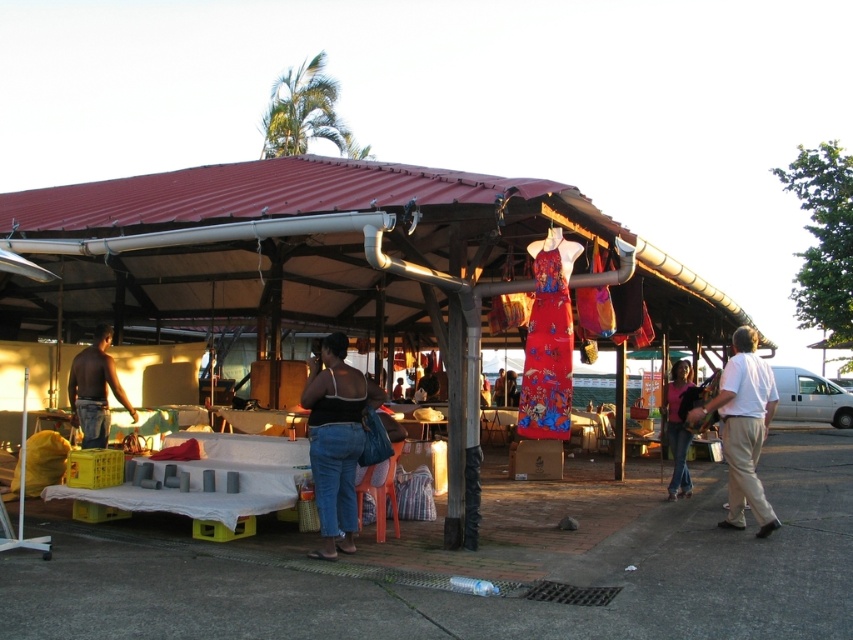
Which of these two, matte plastic dress at center or shiny black skin at left, stands taller?

Standing taller between the two is matte plastic dress at center.

Does point (466, 452) come in front of point (94, 380)?

Yes, it is in front of point (94, 380).

At what (x,y) coordinates should I click in order to perform the action: click on matte plastic dress at center. Please return your answer as a coordinate pair (x, y). This screenshot has width=853, height=640. Looking at the image, I should click on click(x=329, y=259).

In the scene shown: Is white cotton shirt at right shorter than shiny black skin at left?

Incorrect, white cotton shirt at right's height does not fall short of shiny black skin at left's.

Is white cotton shirt at right in front of shiny black skin at left?

Yes, white cotton shirt at right is closer to the viewer.

The width and height of the screenshot is (853, 640). What do you see at coordinates (743, 428) in the screenshot?
I see `white cotton shirt at right` at bounding box center [743, 428].

The height and width of the screenshot is (640, 853). I want to click on white cotton shirt at right, so click(x=743, y=428).

Is black fabric dress at center wider than white cotton shirt at right?

In fact, black fabric dress at center might be narrower than white cotton shirt at right.

Where is `black fabric dress at center`? black fabric dress at center is located at coordinates (335, 440).

Locate an element on the screen. This screenshot has height=640, width=853. black fabric dress at center is located at coordinates (335, 440).